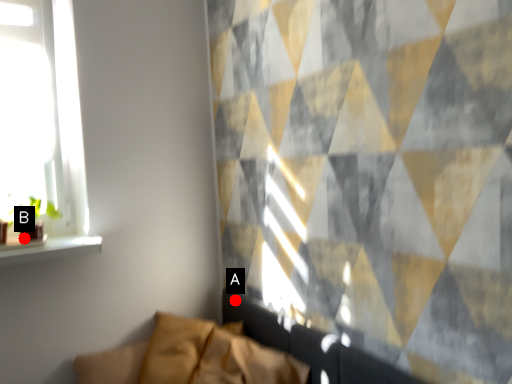
Question: Two points are circled on the image, labeled by A and B beside each circle. Among these points, which one is farthest from the camera?

Choices:
 (A) A is further
 (B) B is further

Answer: (A)